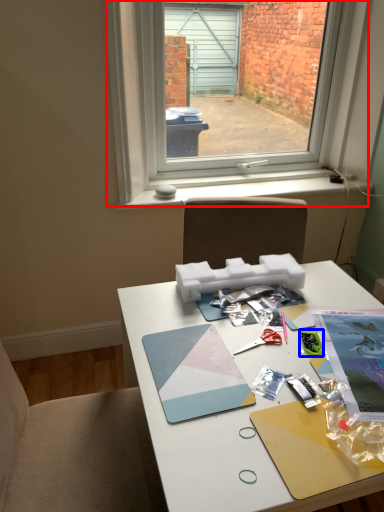
Question: Which of the following is the farthest to the observer, window (highlighted by a red box) or stationery (highlighted by a blue box)?

Choices:
 (A) window
 (B) stationery

Answer: (A)